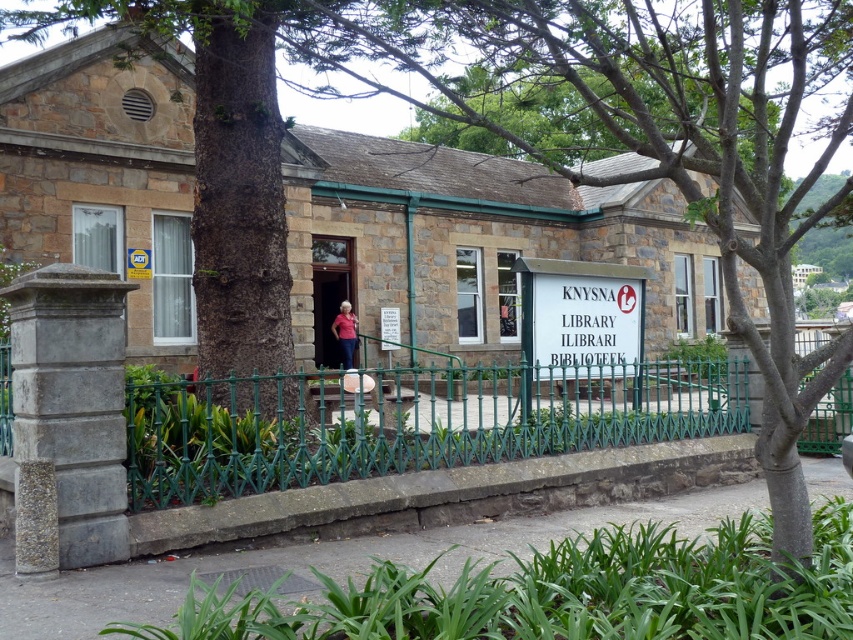
Question: Does green leafy tree at center appear over green wrought iron fence at center?

Choices:
 (A) yes
 (B) no

Answer: (A)

Question: Which of the following is the farthest from the observer?

Choices:
 (A) (392, 435)
 (B) (350, 355)
 (C) (701, 10)

Answer: (B)

Question: Considering the real-world distances, which object is closest to the green leafy tree at center?

Choices:
 (A) white plastic sign at center
 (B) pink fabric shirt at center
 (C) green wrought iron fence at center

Answer: (C)

Question: Does green leafy tree at center lie behind white plastic sign at center?

Choices:
 (A) yes
 (B) no

Answer: (B)

Question: Considering the relative positions of green leafy tree at center and white plastic sign at center in the image provided, where is green leafy tree at center located with respect to white plastic sign at center?

Choices:
 (A) above
 (B) below

Answer: (A)

Question: Which is nearer to the white plastic sign at center?

Choices:
 (A) pink fabric shirt at center
 (B) green wrought iron fence at center

Answer: (B)